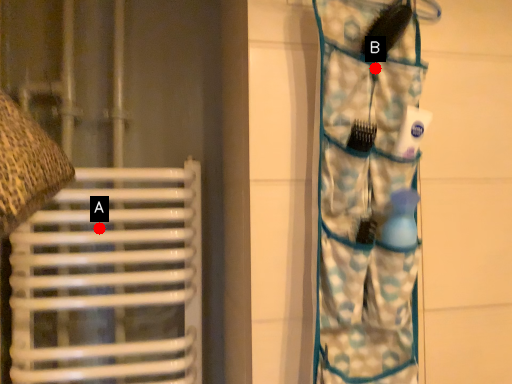
Question: Two points are circled on the image, labeled by A and B beside each circle. Which point is further to the camera?

Choices:
 (A) A is further
 (B) B is further

Answer: (A)